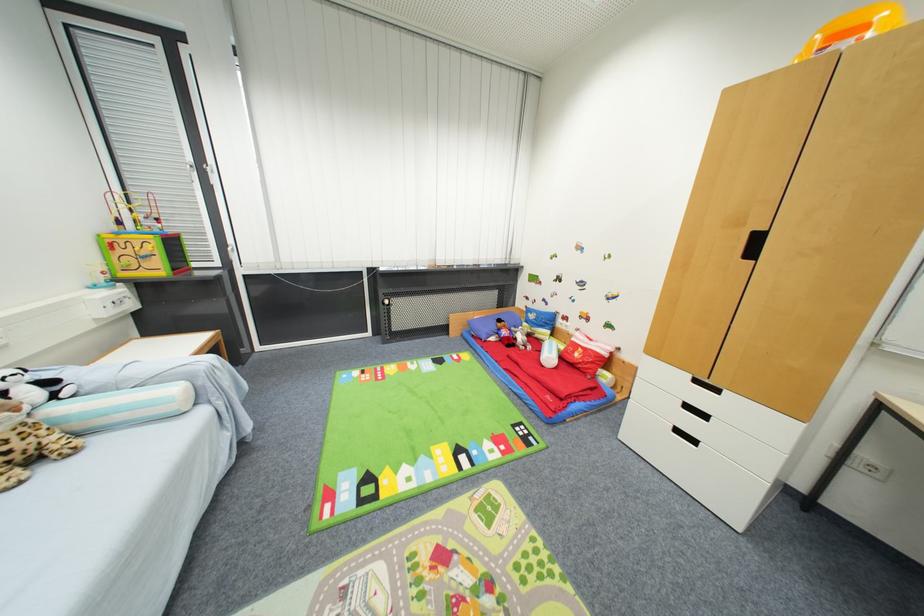
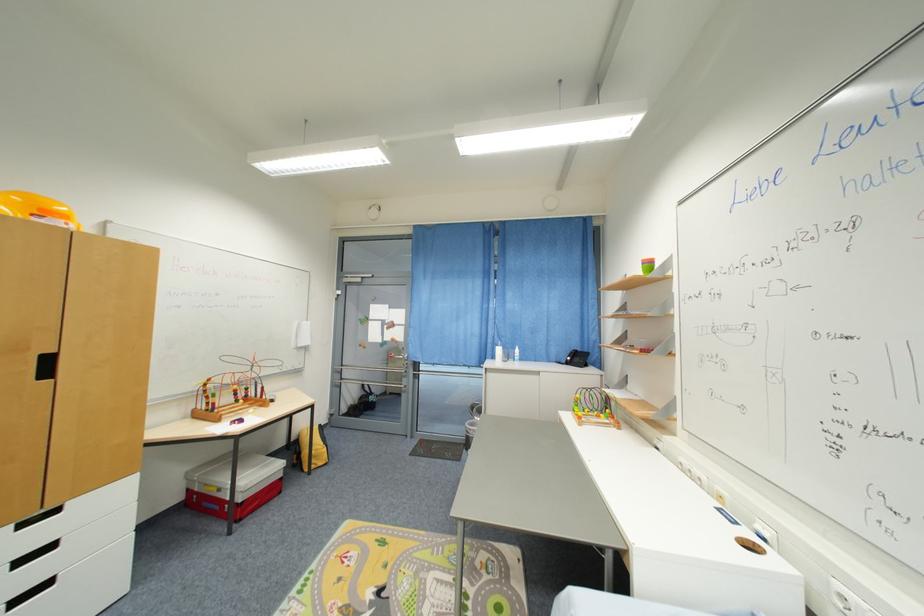
Find the pixel in the second image that matches pixel 868 30 in the first image.

(69, 217)